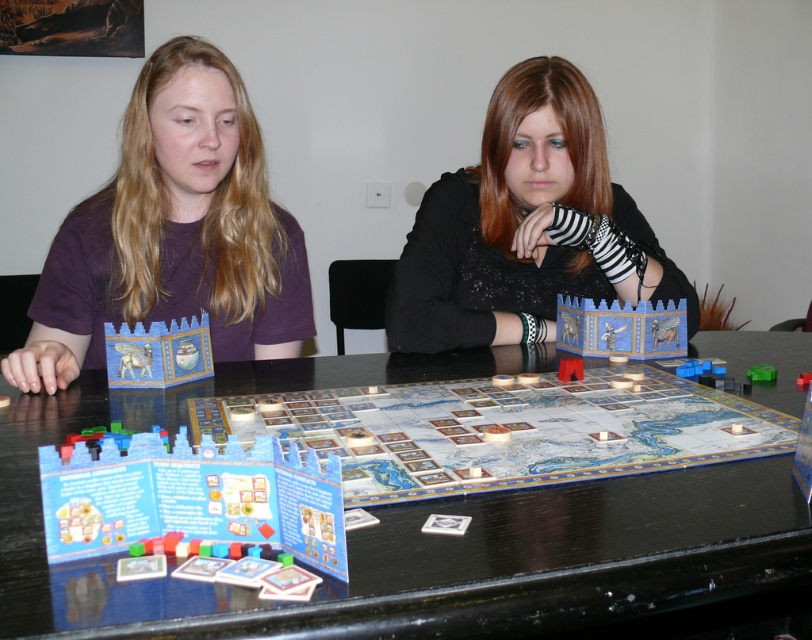
Question: Which point is farther to the camera?

Choices:
 (A) (166, 586)
 (B) (57, 468)

Answer: (B)

Question: Is matte purple shirt at left below green plastic cube at lower right?

Choices:
 (A) yes
 (B) no

Answer: (B)

Question: Is matte purple shirt at left thinner than blue cardboard instruction booklets at center?

Choices:
 (A) no
 (B) yes

Answer: (A)

Question: Estimate the real-world distances between objects in this image. Which object is closer to the matte purple shirt at left?

Choices:
 (A) wooden board game at center
 (B) blue cardboard castle at center

Answer: (B)

Question: Among these objects, which one is nearest to the camera?

Choices:
 (A) wooden board game at center
 (B) black textured sweater at center

Answer: (A)

Question: Is black textured sweater at center closer to camera compared to green plastic cube at lower right?

Choices:
 (A) no
 (B) yes

Answer: (A)